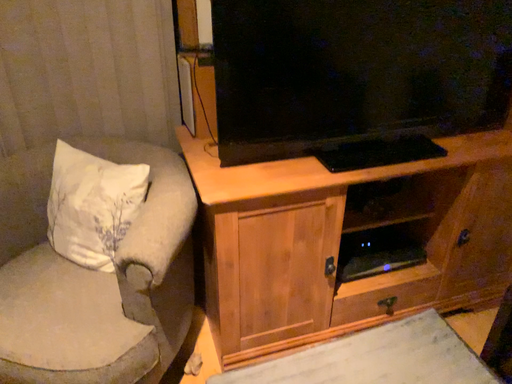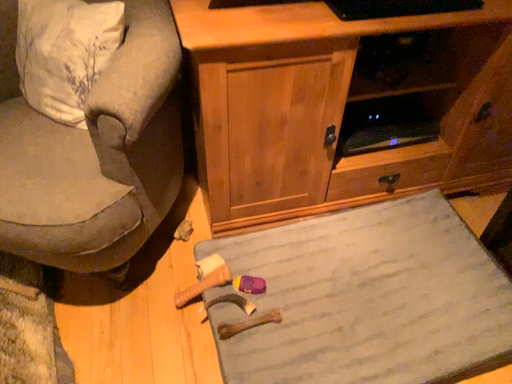
Question: Which way did the camera rotate in the video?

Choices:
 (A) rotated downward
 (B) rotated upward

Answer: (A)